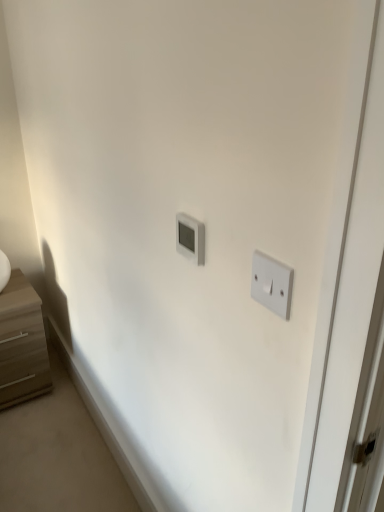
Question: In terms of height, does white plastic light switch at right, the first light switch when ordered from right to left, look taller or shorter compared to white plastic thermostat at center, arranged as the 2th light switch when viewed from the right?

Choices:
 (A) short
 (B) tall

Answer: (B)

Question: Would you say white plastic light switch at right, which appears as the 2th light switch when viewed from the left, is inside or outside white plastic thermostat at center, acting as the first light switch starting from the left?

Choices:
 (A) outside
 (B) inside

Answer: (A)

Question: Which of these objects is positioned closest to the white plastic thermostat at center, the 2th light switch viewed from the front?

Choices:
 (A) light brown wood chest of drawers at left
 (B) white plastic light switch at right, the first light switch when ordered from right to left

Answer: (B)

Question: Which object is the farthest from the white plastic light switch at right, marked as the second light switch in a back-to-front arrangement?

Choices:
 (A) light brown wood chest of drawers at left
 (B) white plastic thermostat at center, arranged as the 2th light switch when viewed from the right

Answer: (A)